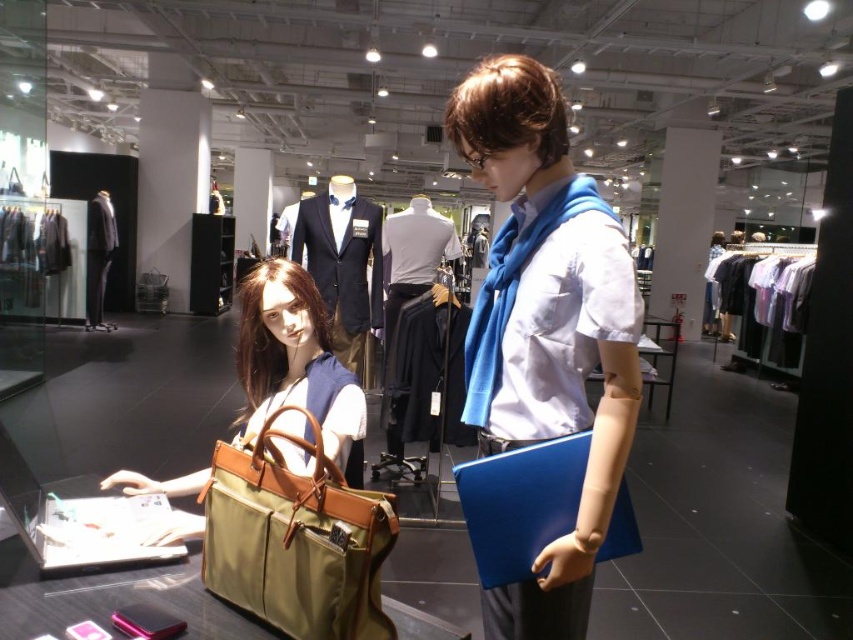
Can you confirm if tan leather briefcase at center is positioned to the left of black suit at center?

No, tan leather briefcase at center is not to the left of black suit at center.

Can you confirm if tan leather briefcase at center is positioned below black suit at center?

Yes.

Does point (260, 461) lie behind point (90, 237)?

No.

Identify the location of tan leather briefcase at center. This screenshot has height=640, width=853. (296, 538).

Is matte blue scarf at center shorter than matte black suit at center?

In fact, matte blue scarf at center may be taller than matte black suit at center.

Can you confirm if matte blue scarf at center is positioned to the right of matte black suit at center?

Indeed, matte blue scarf at center is positioned on the right side of matte black suit at center.

Where is `matte blue scarf at center`? The height and width of the screenshot is (640, 853). matte blue scarf at center is located at coordinates (546, 326).

Is matte black suit at center shorter than white cotton shirt at center?

No, matte black suit at center is not shorter than white cotton shirt at center.

Does matte black suit at center lie behind white cotton shirt at center?

No, matte black suit at center is closer to the viewer.

This screenshot has width=853, height=640. What do you see at coordinates (343, 262) in the screenshot? I see `matte black suit at center` at bounding box center [343, 262].

You are a GUI agent. You are given a task and a screenshot of the screen. Output one action in this format:
    pyautogui.click(x=<x>, y=<y>)
    Task: Click on the matte black suit at center
    
    Given the screenshot: What is the action you would take?
    pyautogui.click(x=343, y=262)